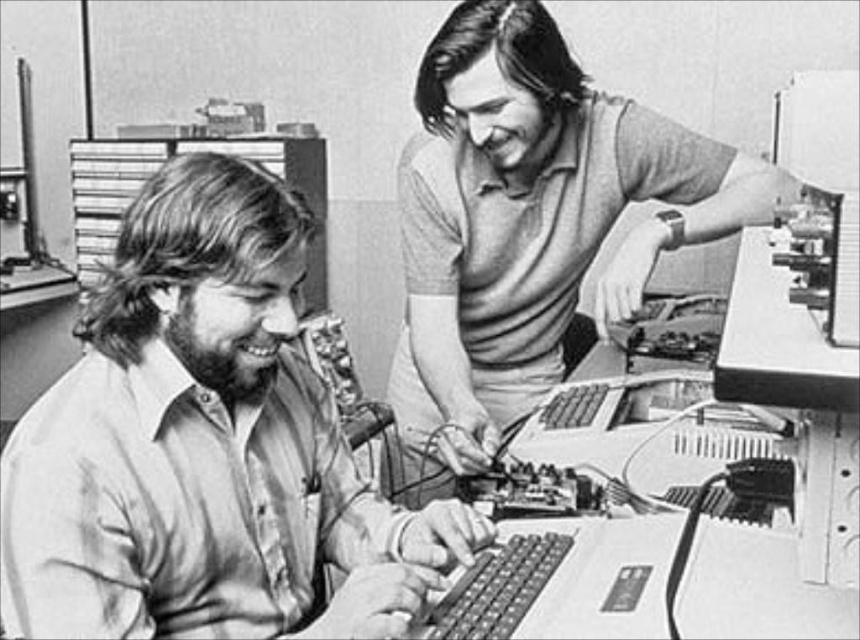
Question: Does light brown shirt at left have a larger size compared to smooth gray shirt at upper right?

Choices:
 (A) yes
 (B) no

Answer: (B)

Question: Which object is closer to the camera taking this photo?

Choices:
 (A) smooth gray shirt at upper right
 (B) light brown shirt at left

Answer: (B)

Question: Is light brown shirt at left smaller than smooth gray shirt at upper right?

Choices:
 (A) no
 (B) yes

Answer: (B)

Question: Which point is closer to the camera taking this photo?

Choices:
 (A) (108, 452)
 (B) (582, 131)

Answer: (A)

Question: Can you confirm if light brown shirt at left is positioned above smooth gray shirt at upper right?

Choices:
 (A) no
 (B) yes

Answer: (B)